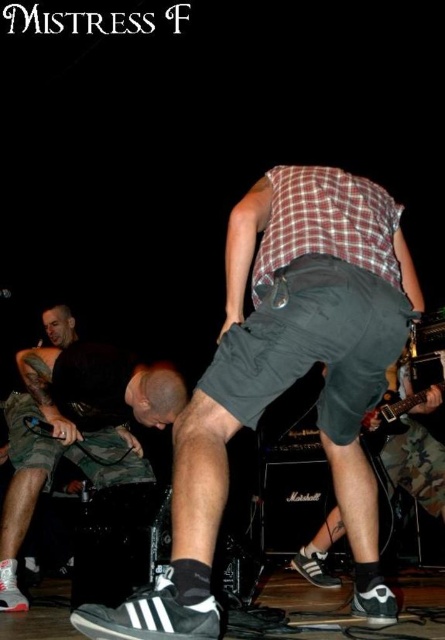
Is point (178, 529) positioned behind point (68, 372)?

No.

What do you see at coordinates (284, 378) in the screenshot? I see `dark gray cotton shorts at center` at bounding box center [284, 378].

Which is behind, point (339, 428) or point (60, 353)?

Point (60, 353)

In order to click on dark gray cotton shorts at center in this screenshot , I will do `click(284, 378)`.

Can you confirm if dark gray cotton shorts at center is positioned to the left of electric guitar at lower right?

Indeed, dark gray cotton shorts at center is positioned on the left side of electric guitar at lower right.

Which is behind, point (287, 298) or point (384, 420)?

The point (384, 420) is more distant.

Find the location of `dark gray cotton shorts at center`. dark gray cotton shorts at center is located at coordinates (284, 378).

Who is positioned more to the left, camouflage shorts at lower left or electric guitar at lower right?

From the viewer's perspective, camouflage shorts at lower left appears more on the left side.

Is camouflage shorts at lower left bigger than electric guitar at lower right?

Yes, camouflage shorts at lower left is bigger than electric guitar at lower right.

I want to click on camouflage shorts at lower left, so click(76, 426).